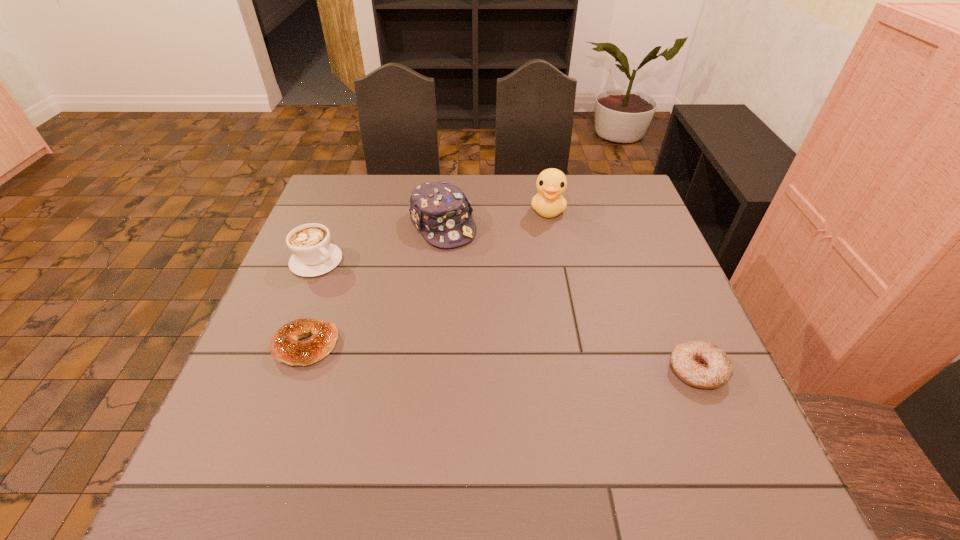
Identify the location of bagel located in the left edge section of the desktop. This screenshot has width=960, height=540. (285, 347).

The image size is (960, 540). Identify the location of cappuccino located in the left edge section of the desktop. (313, 254).

Find the location of a particular element. The width and height of the screenshot is (960, 540). object at the right edge is located at coordinates (701, 364).

Image resolution: width=960 pixels, height=540 pixels. In the image, there is a desktop. What are the coordinates of `vacant space at the far edge` in the screenshot? It's located at (489, 174).

Identify the location of free region at the near edge of the desktop. (564, 403).

Where is `free space at the right edge of the desktop`? The image size is (960, 540). free space at the right edge of the desktop is located at coordinates (647, 353).

Locate an element on the screen. This screenshot has width=960, height=540. vacant region at the far left corner of the desktop is located at coordinates (316, 208).

Where is `blank space at the far right corner`? Image resolution: width=960 pixels, height=540 pixels. blank space at the far right corner is located at coordinates (598, 188).

The image size is (960, 540). Identify the location of vacant area between the bagel and the third tallest object. (311, 303).

Where is `free spot between the second object from right to left and the second tallest object`? Image resolution: width=960 pixels, height=540 pixels. free spot between the second object from right to left and the second tallest object is located at coordinates (495, 218).